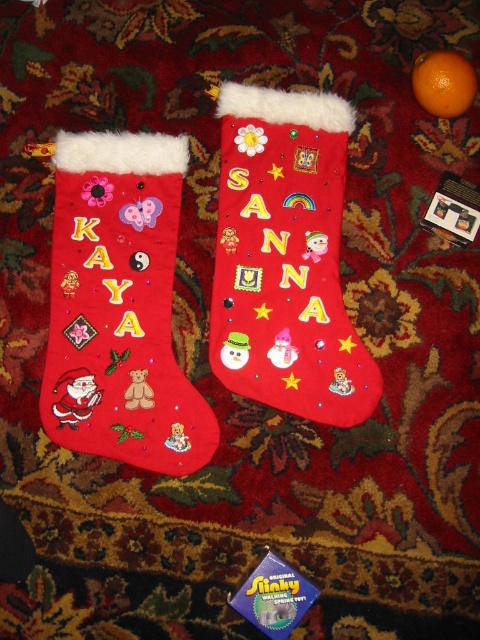
Question: Does felt/embroidered stocking at center come in front of orangesmoothorange at upper right?

Choices:
 (A) no
 (B) yes

Answer: (A)

Question: Which point appears farthest from the camera in this image?

Choices:
 (A) click(120, 332)
 (B) click(433, 65)
 (C) click(263, 170)

Answer: (C)

Question: Does matte red stocking at left appear on the left side of felt/embroidered stocking at center?

Choices:
 (A) no
 (B) yes

Answer: (B)

Question: Can you confirm if matte red stocking at left is positioned to the right of felt/embroidered stocking at center?

Choices:
 (A) no
 (B) yes

Answer: (A)

Question: Which of the following is the closest to the observer?

Choices:
 (A) matte red stocking at left
 (B) felt/embroidered stocking at center
 (C) orangesmoothorange at upper right

Answer: (C)

Question: Which point is closer to the camera?

Choices:
 (A) matte red stocking at left
 (B) felt/embroidered stocking at center

Answer: (A)